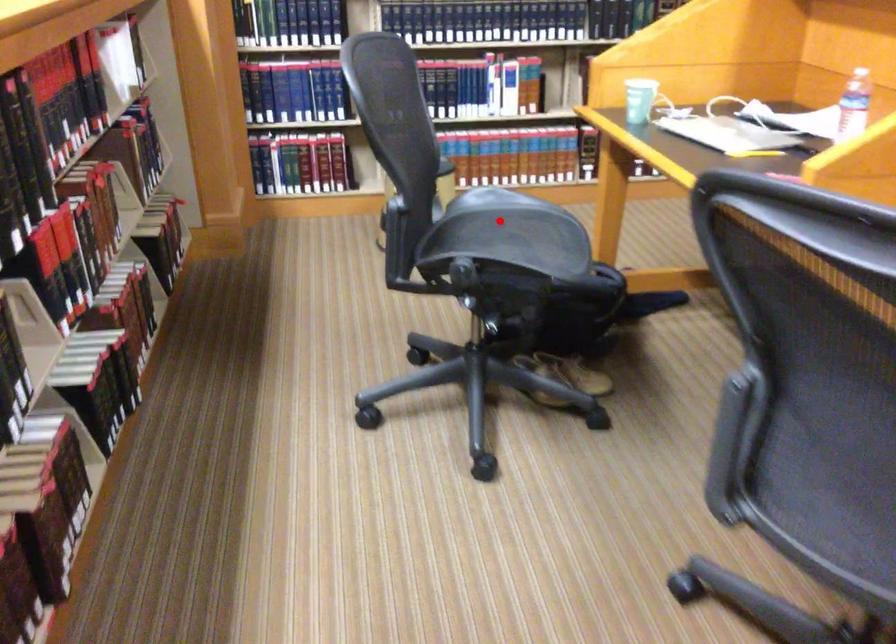
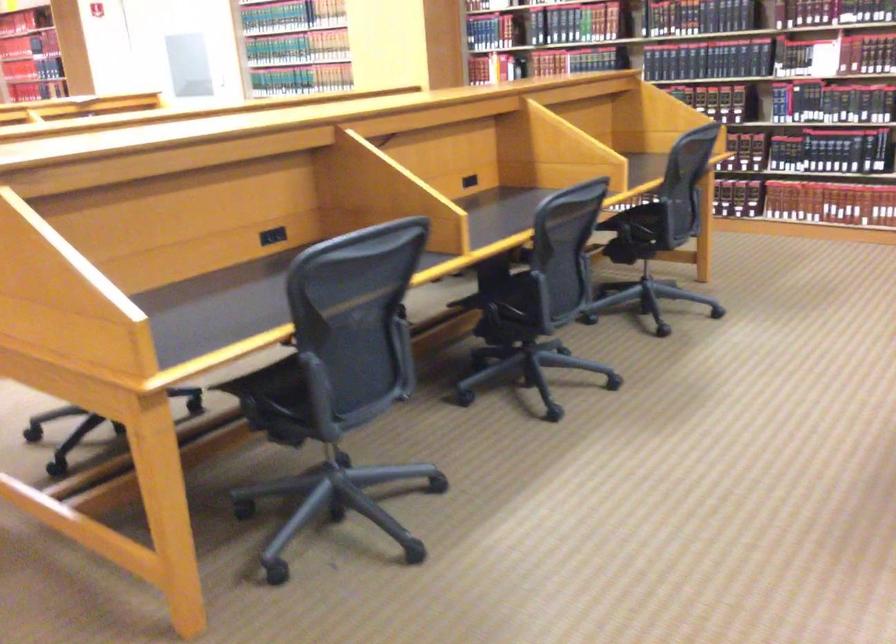
Question: I am providing you with two images of the same scene from different viewpoints. A red point is marked on the first image. Can you still see the location of the red point in image 2?

Choices:
 (A) Yes
 (B) No

Answer: (B)